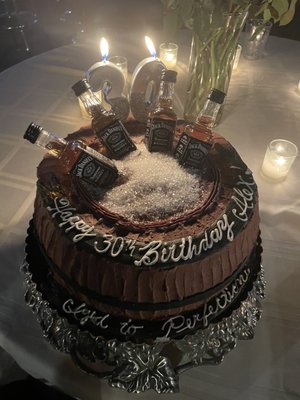
The height and width of the screenshot is (400, 300). Find the location of `table`. table is located at coordinates (263, 85).